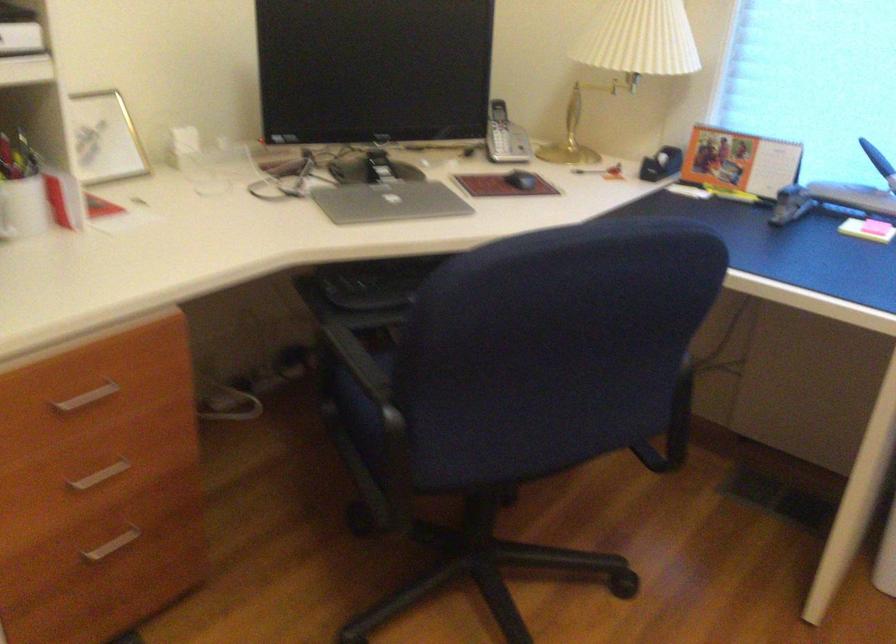
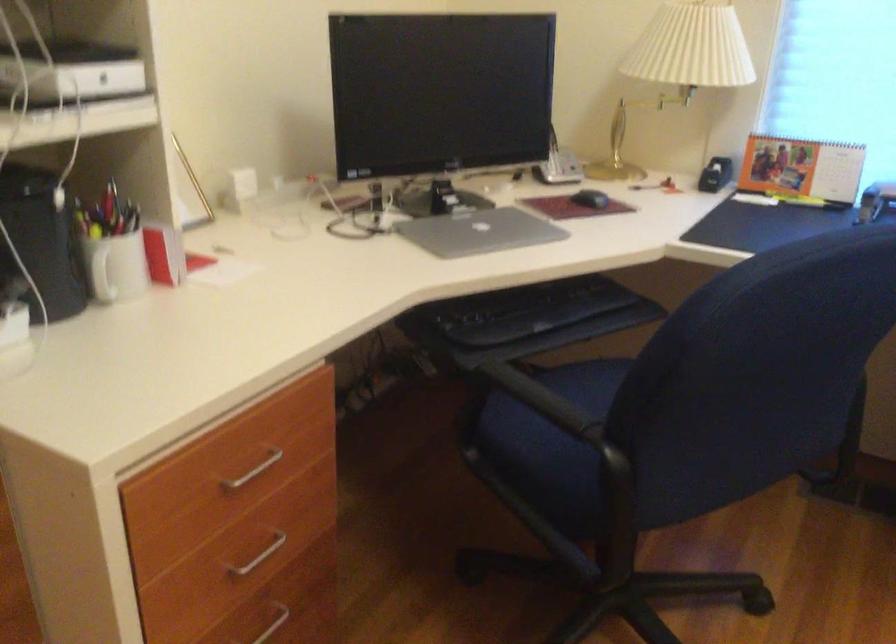
Question: Based on the continuous images, in which direction is the camera rotating? Reply with the corresponding letter.

Choices:
 (A) Left
 (B) Right
 (C) Up
 (D) Down

Answer: (B)